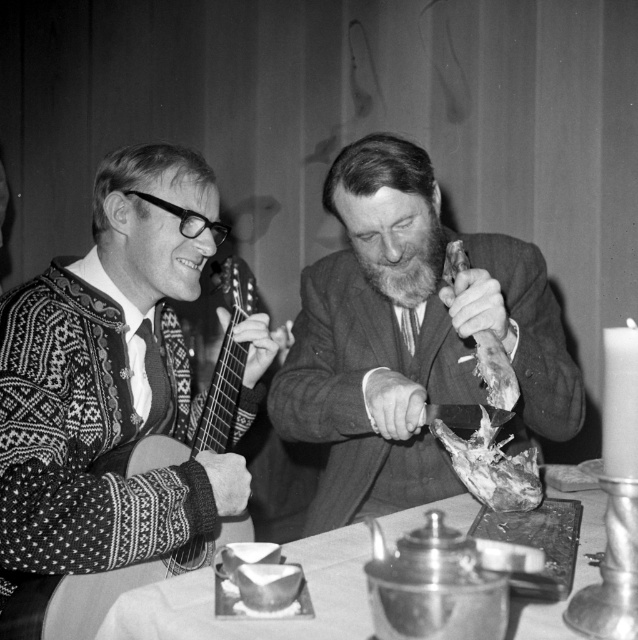
Which is in front, point (154, 157) or point (540, 348)?

Point (540, 348) is in front.

Who is more forward, [197,481] or [308,388]?

Point [197,481] is more forward.

Find the location of a particular element. This screenshot has height=640, width=638. knitted sweater at left is located at coordinates (110, 384).

Who is more distant from viewer, (184, 612) or (521, 509)?

Positioned behind is point (521, 509).

Which of these two, metallic silver table at lower center or raw meat at center, stands shorter?

Standing shorter between the two is metallic silver table at lower center.

Does point (330, 632) come farther from viewer compared to point (486, 435)?

No, it is not.

The image size is (638, 640). I want to click on metallic silver table at lower center, so click(260, 620).

Is point (205, 636) more distant than point (480, 365)?

No, (205, 636) is closer to viewer.

Is the position of metallic silver table at lower center more distant than that of leathery brown skin at right?

No.

Who is more distant from viewer, [352,577] or [447,269]?

The point [447,269] is behind.

The image size is (638, 640). What are the coordinates of `metallic silver table at lower center` in the screenshot? It's located at (260, 620).